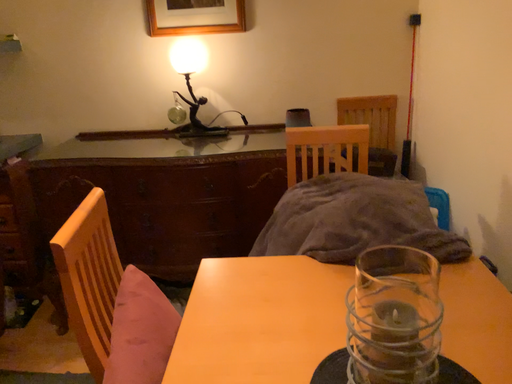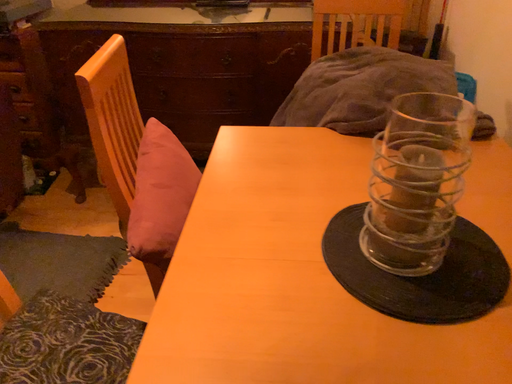
Question: Which way did the camera rotate in the video?

Choices:
 (A) rotated downward
 (B) rotated upward

Answer: (A)